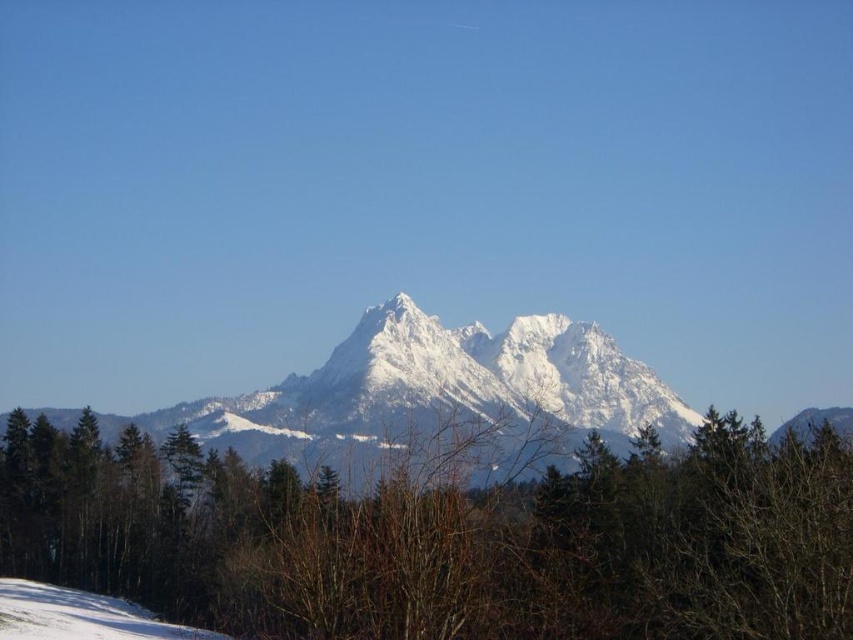
You are an environmental scientist assessing the terrain. You need to determine which object, the green matte tree at center or the white snow at lower left, is taller. Based on the scene, what can you conclude?

The green matte tree at center is much taller than the white snow at lower left, so the green matte tree at center is taller.

You are standing in the mountains and see a point marked at coordinates (447,540). Based on the scene description, which object is this point located on?

The point at coordinates (447,540) is located on the green matte tree at center.